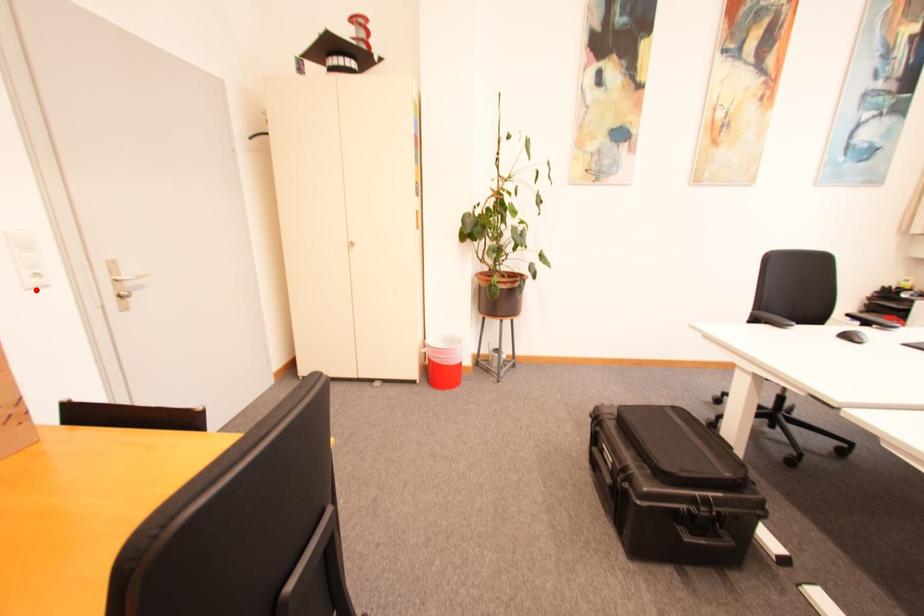
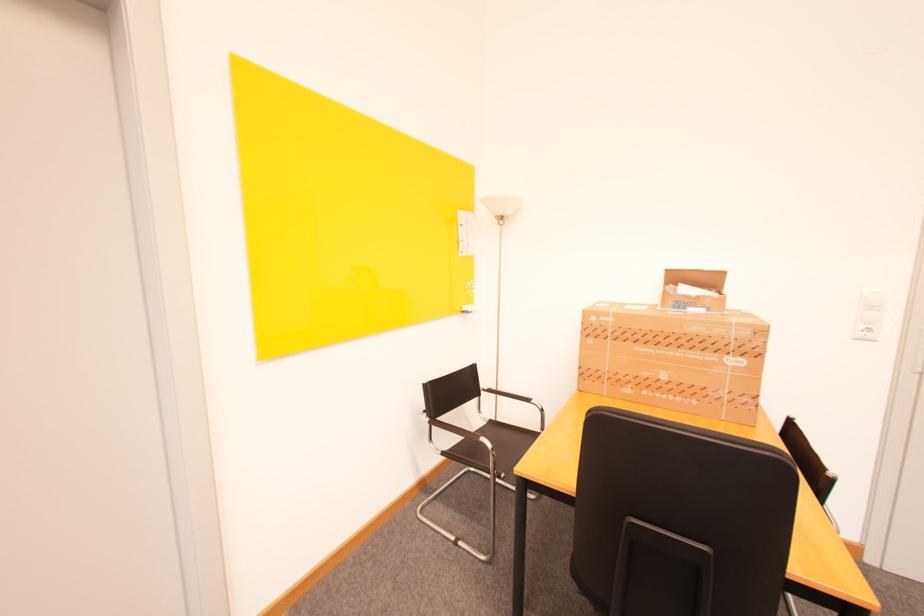
Locate, in the second image, the point that corresponds to the highlighted location in the first image.

(862, 339)